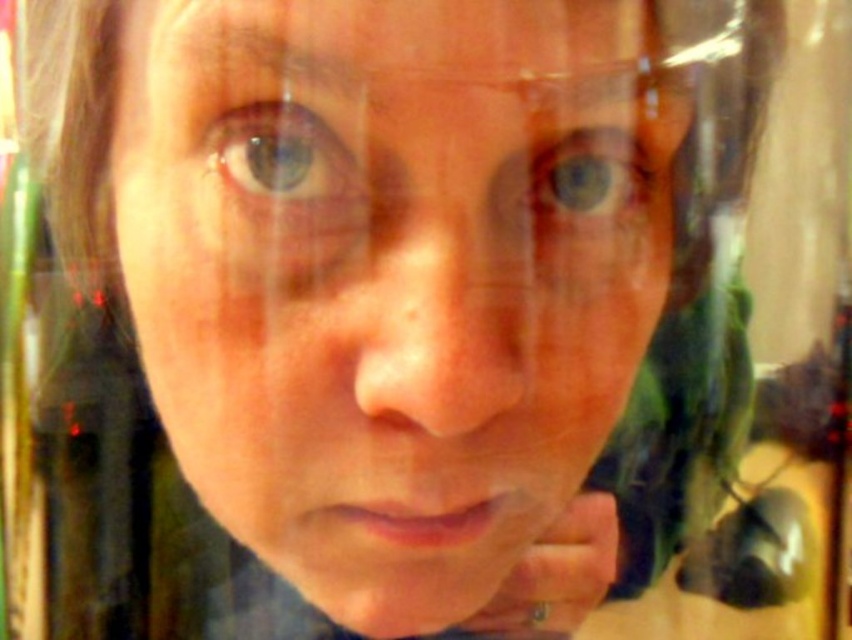
Question: Does silver metallic ring at lower center appear on the left side of blue matte eye at upper center?

Choices:
 (A) yes
 (B) no

Answer: (A)

Question: Which of the following is the farthest from the observer?

Choices:
 (A) coord(330,132)
 (B) coord(468,99)
 (C) coord(634,168)
 (D) coord(528,609)

Answer: (D)

Question: Estimate the real-world distances between objects in this image. Which object is closer to the smooth skin face at center?

Choices:
 (A) silver metallic ring at lower center
 (B) blue glossy eye at upper center

Answer: (B)

Question: Is blue glossy eye at upper center further to the viewer compared to blue matte eye at upper center?

Choices:
 (A) yes
 (B) no

Answer: (B)

Question: Which of the following is the closest to the observer?

Choices:
 (A) silver metallic ring at lower center
 (B) blue glossy eye at upper center
 (C) blue matte eye at upper center
 (D) smooth skin face at center

Answer: (D)

Question: In this image, where is smooth skin face at center located relative to silver metallic ring at lower center?

Choices:
 (A) left
 (B) right

Answer: (A)